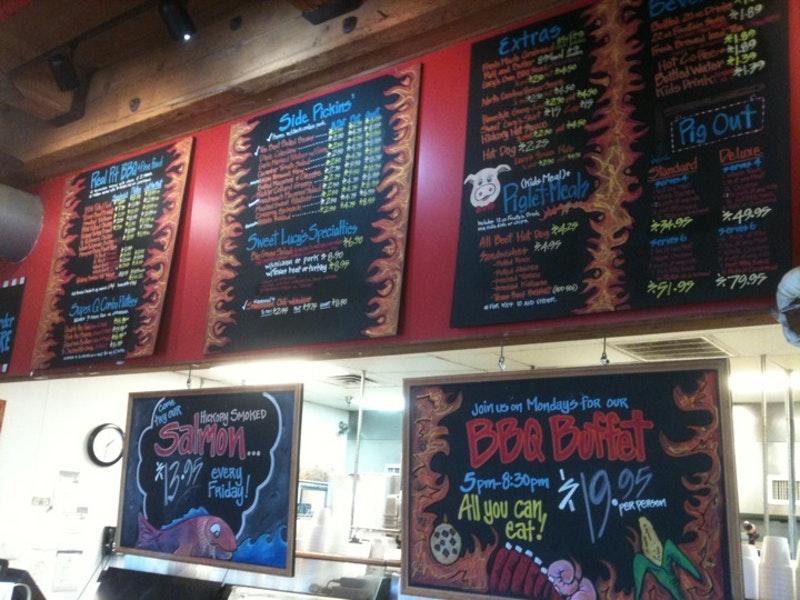
You are a GUI agent. You are given a task and a screenshot of the screen. Output one action in this format:
    pyautogui.click(x=<x>, y=<y>)
    Task: Click on the clock
    This screenshot has width=800, height=600.
    Given the screenshot: What is the action you would take?
    pyautogui.click(x=106, y=442)